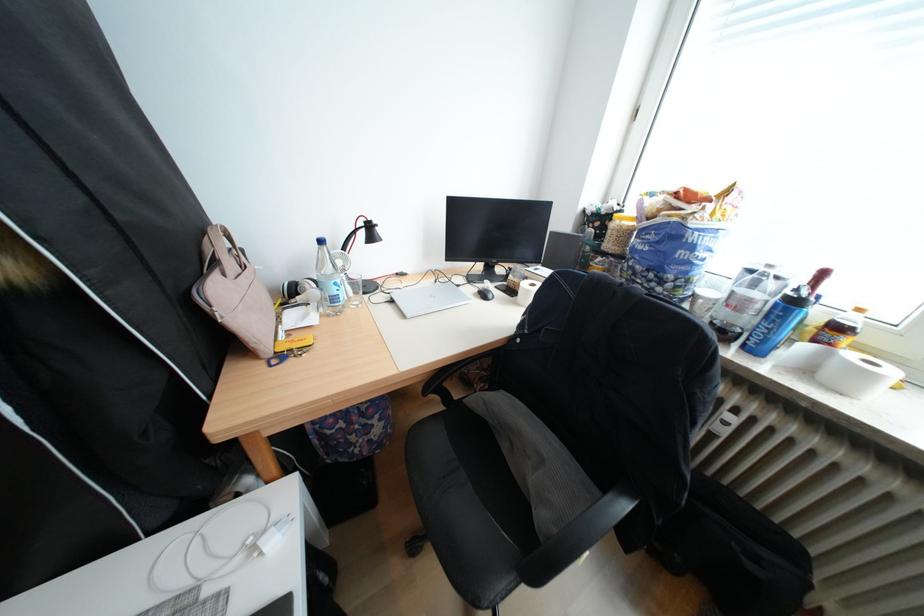
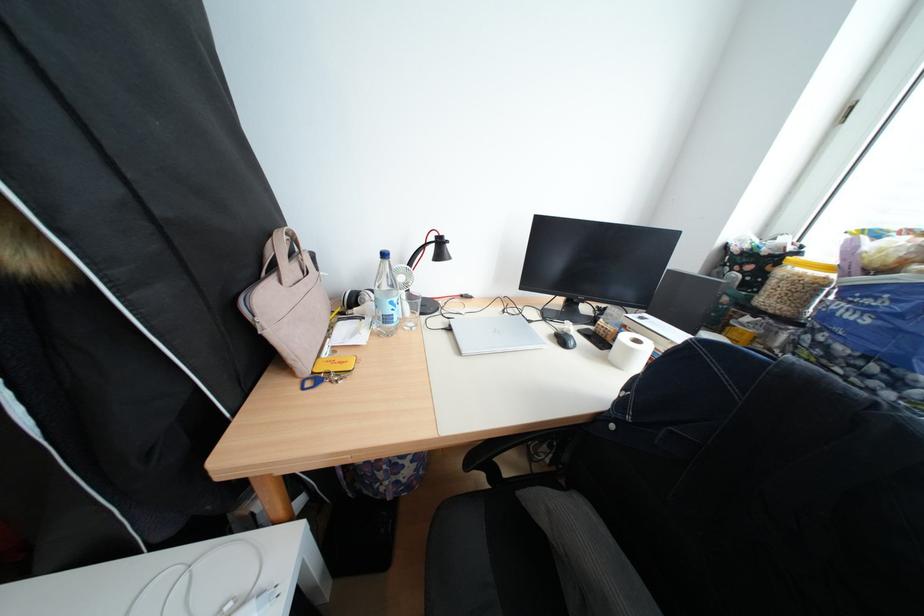
Question: The first image is from the beginning of the video and the second image is from the end. How did the camera likely rotate when shooting the video?

Choices:
 (A) Left
 (B) Right
 (C) Up
 (D) Down

Answer: (A)